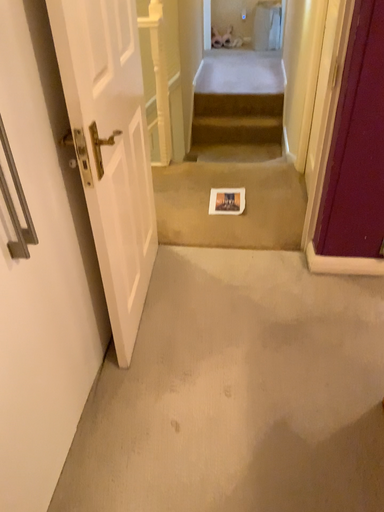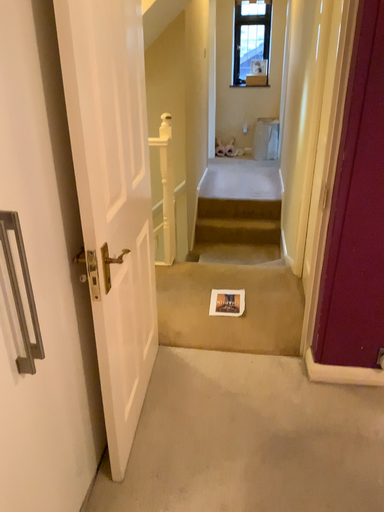
Question: How did the camera likely rotate when shooting the video?

Choices:
 (A) rotated downward
 (B) rotated upward

Answer: (B)